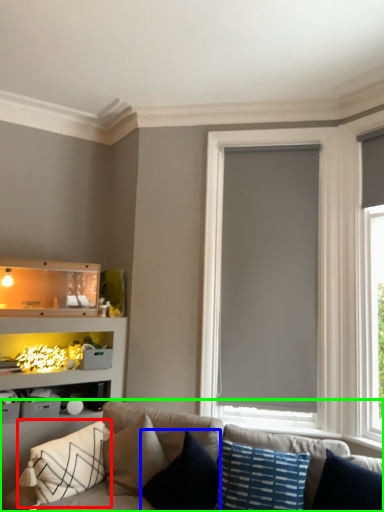
Question: Which object is positioned farthest from pillow (highlighted by a red box)? Select from pillow (highlighted by a blue box) and studio couch (highlighted by a green box).

Choices:
 (A) pillow
 (B) studio couch

Answer: (A)